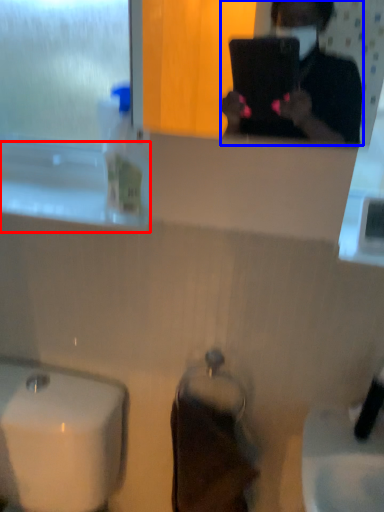
Question: Which object is closer to the camera taking this photo, window sill (highlighted by a red box) or person (highlighted by a blue box)?

Choices:
 (A) window sill
 (B) person

Answer: (B)